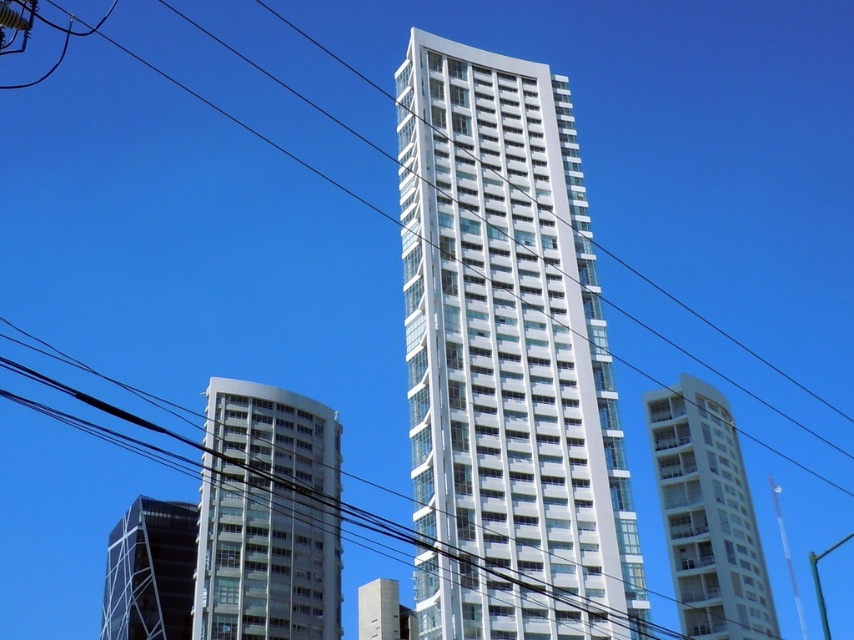
Question: Which point appears closest to the camera in this image?

Choices:
 (A) (420, 369)
 (B) (189, 630)
 (C) (674, 428)

Answer: (A)

Question: Which of these objects is positioned closest to the white glass building at right?

Choices:
 (A) white glass building at lower left
 (B) black glass building at lower left
 (C) white glass building at center

Answer: (A)

Question: Which point is farther from the camera taking this photo?

Choices:
 (A) (143, 636)
 (B) (208, 429)
 (C) (580, 625)

Answer: (A)

Question: Does white glass building at center come behind black glass building at lower left?

Choices:
 (A) no
 (B) yes

Answer: (A)

Question: Is white glass building at center wider than white glass building at lower left?

Choices:
 (A) yes
 (B) no

Answer: (B)

Question: In this image, where is white glass building at right located relative to black glass building at lower left?

Choices:
 (A) right
 (B) left

Answer: (A)